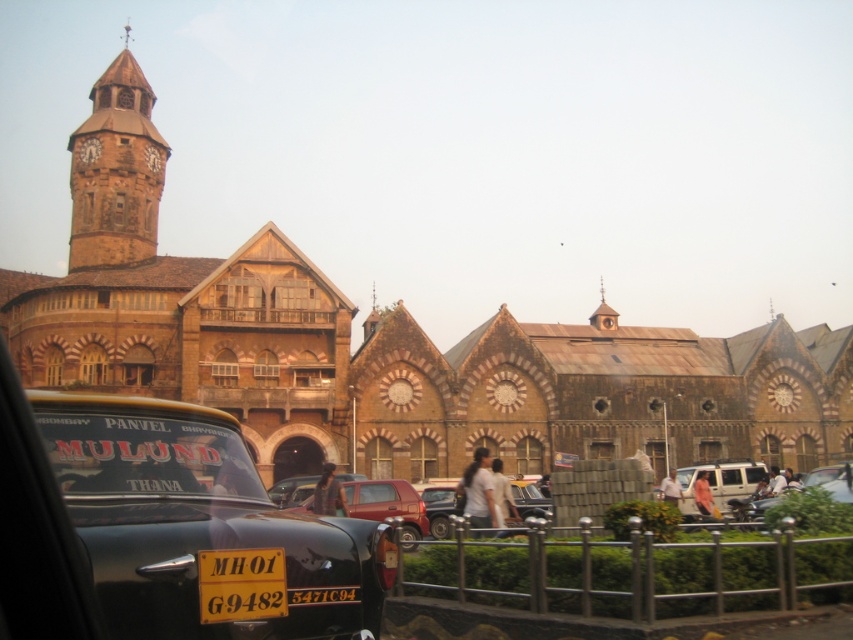
Question: Observing the image, what is the correct spatial positioning of white matte van at center in reference to metallic silver van at center?

Choices:
 (A) above
 (B) below

Answer: (B)

Question: Considering the relative positions of brown stone clock tower at upper left and white matte van at center in the image provided, where is brown stone clock tower at upper left located with respect to white matte van at center?

Choices:
 (A) above
 (B) below

Answer: (A)

Question: Which point is farther to the camera?

Choices:
 (A) (793, 497)
 (B) (526, 500)
 (C) (231, 477)

Answer: (B)

Question: Does metallic silver car at center appear on the right side of metallic silver van at center?

Choices:
 (A) yes
 (B) no

Answer: (B)

Question: Which object appears farthest from the camera in this image?

Choices:
 (A) metallic silver van at center
 (B) transparent glass car window at center
 (C) brown stone clock tower at upper left

Answer: (C)

Question: Which point is farther from the camera taking this photo?

Choices:
 (A) (715, 486)
 (B) (241, 444)
 (C) (421, 492)

Answer: (A)